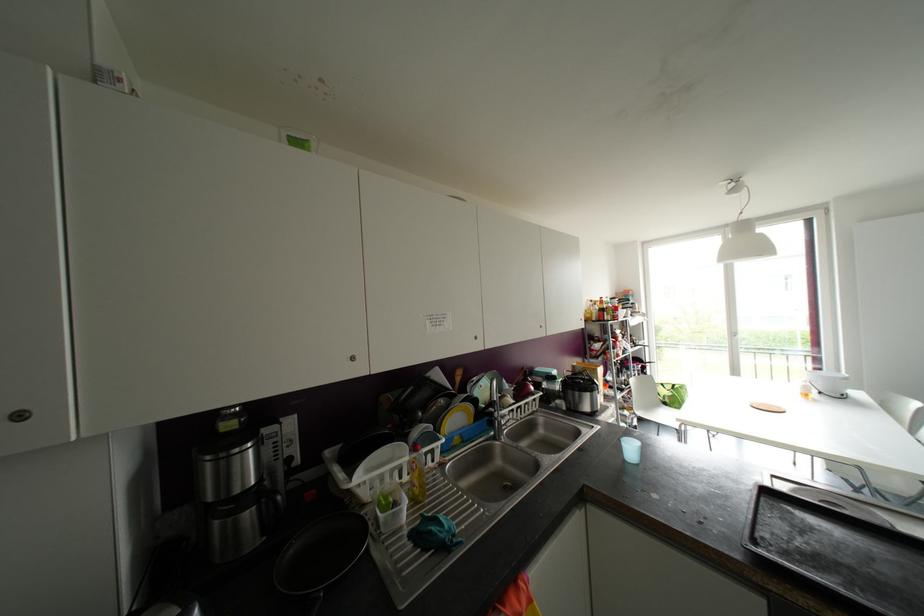
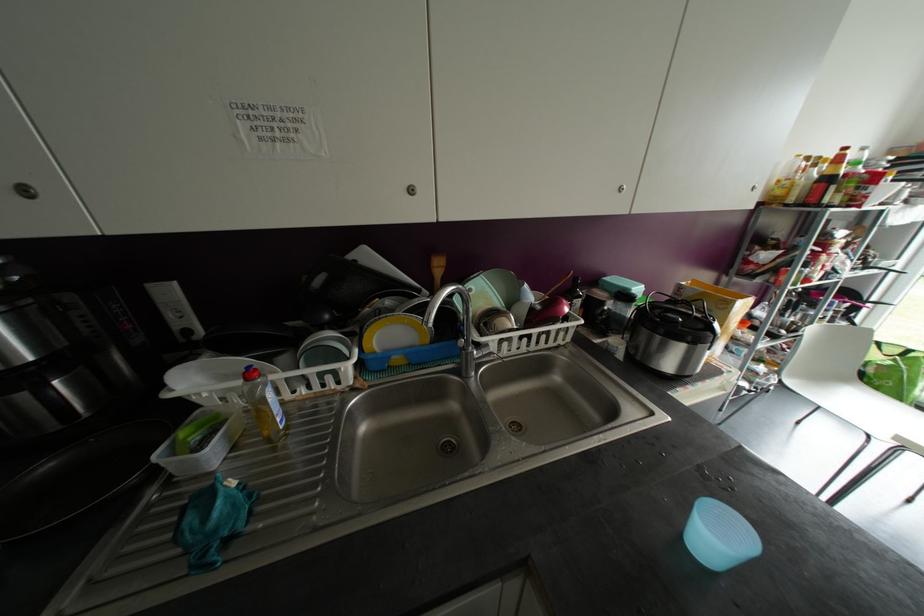
Locate, in the second image, the point that corresponds to point (531, 387) in the first image.

(565, 310)